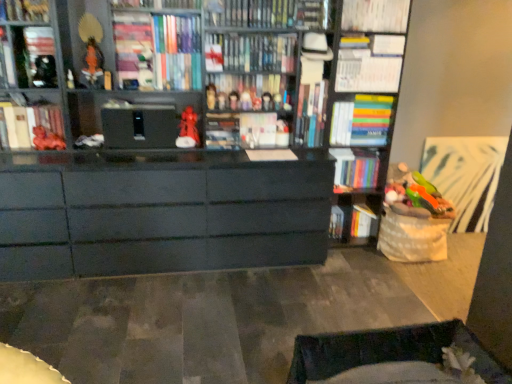
Question: Is matte black bookshelf at upper left, positioned as the 3th book in left-to-right order, taller or shorter than hardcover book at center, which is the 8th book from right to left?

Choices:
 (A) tall
 (B) short

Answer: (B)

Question: Based on their sizes in the image, would you say matte black bookshelf at upper left, which appears as the 11th book when viewed from the right, is bigger or smaller than hardcover book at center, which is the 8th book from right to left?

Choices:
 (A) small
 (B) big

Answer: (A)

Question: Which object is the closest to the matte red figurine at center, the 4th toy positioned from the right?

Choices:
 (A) matte red figurine at center, the fifth toy positioned from the right
 (B) multicolored hardcover book at upper right, the second book in the right-to-left sequence
 (C) matte white book at left, positioned as the 2th book in left-to-right order
 (D) hardcover book at center, the 6th book in the right-to-left sequence
 (E) hardcover book at upper center, which is counted as the seventh book, starting from the left

Answer: (A)

Question: Estimate the real-world distances between objects in this image. Which object is farther from the matte white paperback book at center, which is the 1th paperback book in right-to-left order?

Choices:
 (A) white paper book at lower right, the 1th book when ordered from right to left
 (B) hardcover book at center, the tenth book in the left-to-right sequence
 (C) matte red figurine at center, the fifth toy positioned from the right
 (D) matte black book at upper left, the 1th book when ordered from left to right
 (E) multicolored hardcover book at upper right, the second book in the right-to-left sequence

Answer: (D)